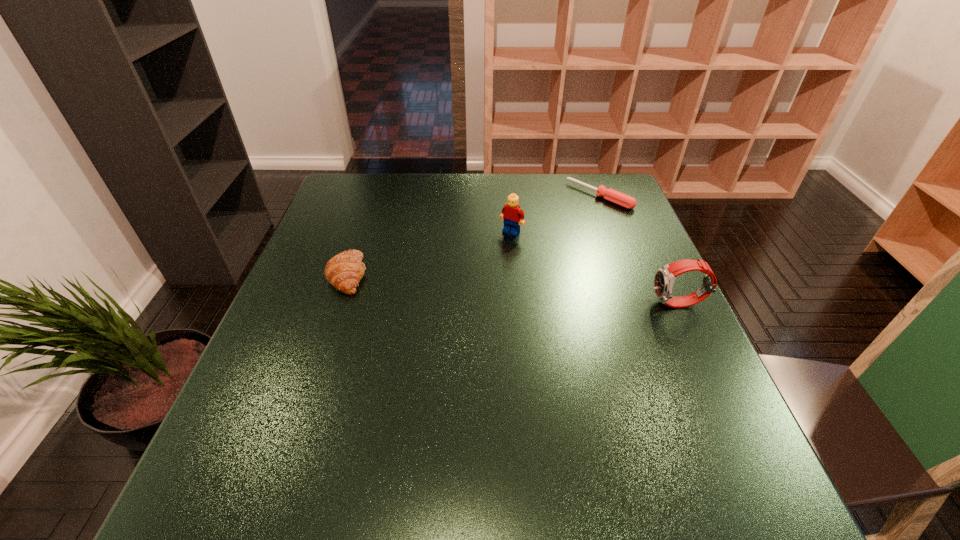
This screenshot has height=540, width=960. I want to click on free spot that satisfies the following two spatial constraints: 1. on the front side of the watch; 2. on the face of the farthest object, so click(x=640, y=304).

Find the location of `vacant region that satisfies the following two spatial constraints: 1. on the front side of the watch; 2. on the face of the crescent roll`. vacant region that satisfies the following two spatial constraints: 1. on the front side of the watch; 2. on the face of the crescent roll is located at coordinates (338, 304).

Locate an element on the screen. Image resolution: width=960 pixels, height=540 pixels. free point that satisfies the following two spatial constraints: 1. on the front side of the crescent roll; 2. on the face of the watch is located at coordinates (338, 304).

At what (x,y) coordinates should I click in order to perform the action: click on vacant area that satisfies the following two spatial constraints: 1. on the back side of the screwdriver; 2. on the right side of the Lego. Please return your answer as a coordinate pair (x, y). This screenshot has height=540, width=960. Looking at the image, I should click on (508, 195).

I want to click on free space that satisfies the following two spatial constraints: 1. on the front side of the watch; 2. on the face of the shortest object, so point(640,304).

You are a GUI agent. You are given a task and a screenshot of the screen. Output one action in this format:
    pyautogui.click(x=<x>, y=<y>)
    Task: Click on the vacant space that satisfies the following two spatial constraints: 1. on the back side of the third nearest object; 2. on the right side of the shortest object
    The width and height of the screenshot is (960, 540).
    Given the screenshot: What is the action you would take?
    pyautogui.click(x=508, y=195)